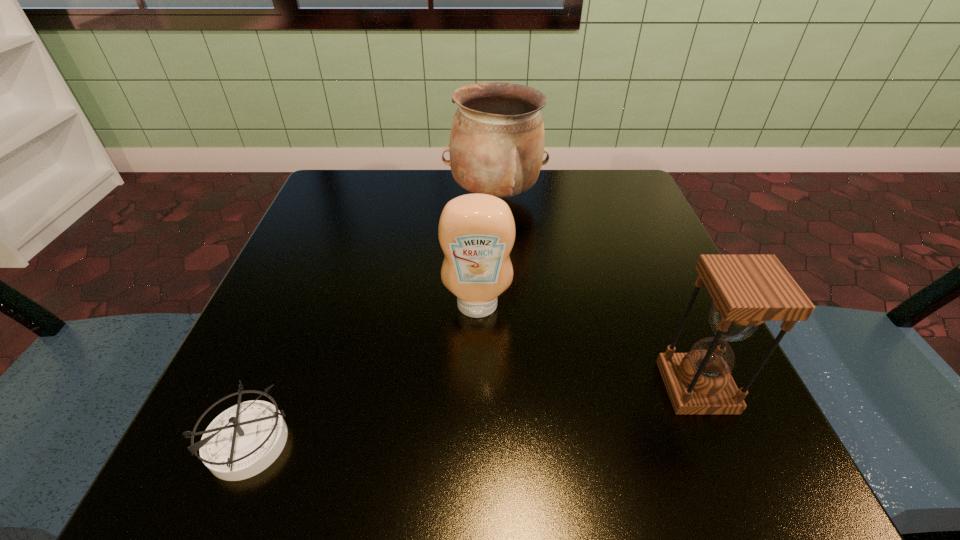
The width and height of the screenshot is (960, 540). Find the location of `vacant area that satisfies the following two spatial constraints: 1. on the front side of the hourglass; 2. on the right side of the farthest object`. vacant area that satisfies the following two spatial constraints: 1. on the front side of the hourglass; 2. on the right side of the farthest object is located at coordinates (504, 387).